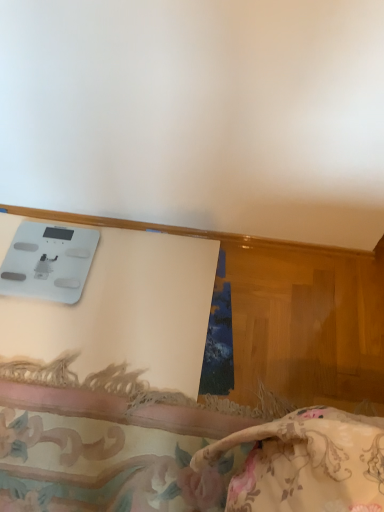
Locate an element on the screen. This screenshot has height=512, width=384. blank space above floral fabric cushion at lower center (from a real-world perspective) is located at coordinates (102, 433).